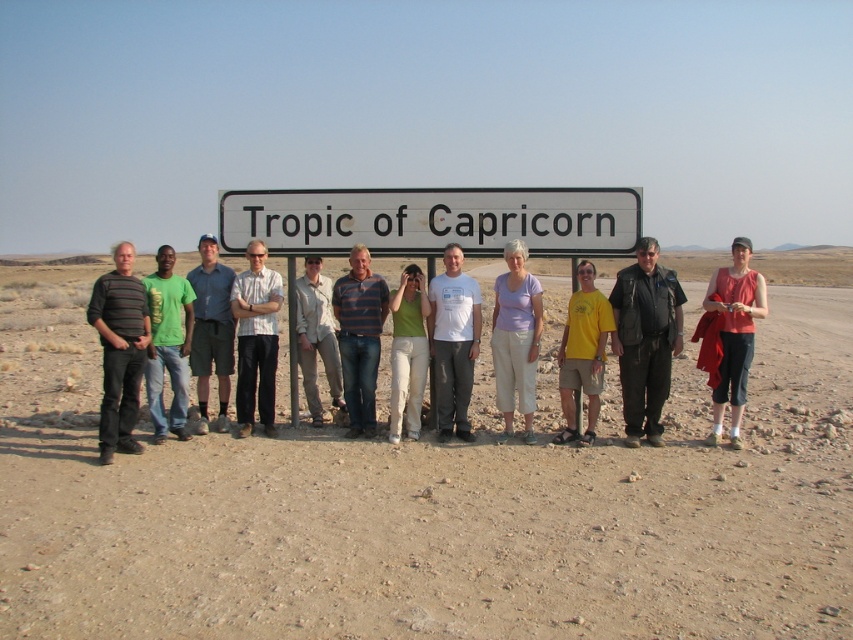
Question: Does green matte shirt at center lie in front of safari shirt at center?

Choices:
 (A) no
 (B) yes

Answer: (B)

Question: Which point is closer to the camera?

Choices:
 (A) light blue shirt at center
 (B) white shirt at center
 (C) striped cotton shirt at left
 (D) matte red tank top at right

Answer: (C)

Question: Does striped cotton shirt at left have a larger size compared to blue striped polo shirt at center?

Choices:
 (A) yes
 (B) no

Answer: (A)

Question: Among these objects, which one is farthest from the camera?

Choices:
 (A) white shirt at center
 (B) light blue shirt at center

Answer: (A)

Question: Is blue striped polo shirt at center positioned at the back of light blue shirt at center?

Choices:
 (A) no
 (B) yes

Answer: (B)

Question: Which object is positioned closest to the light purple cotton shirt at center?

Choices:
 (A) safari shirt at center
 (B) dusty sand at center
 (C) white plastic sign at center
 (D) green matte shirt at center

Answer: (D)